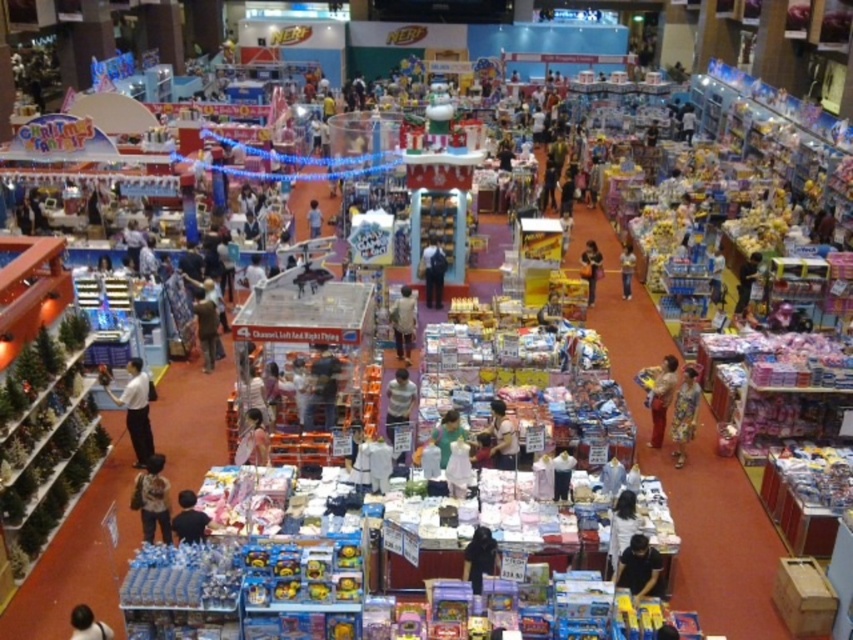
Who is lower down, white matte shirt at lower left or matte black bag at center?

white matte shirt at lower left is lower down.

Does white matte shirt at lower left have a lesser height compared to matte black bag at center?

Incorrect, white matte shirt at lower left's height does not fall short of matte black bag at center's.

Is point (154, 449) closer to viewer compared to point (584, 275)?

Yes, it is in front of point (584, 275).

Where is `white matte shirt at lower left`? This screenshot has width=853, height=640. white matte shirt at lower left is located at coordinates click(136, 410).

Measure the distance from matte yellow shirt at center to light brown fabric shirt at center.

matte yellow shirt at center and light brown fabric shirt at center are 10.25 feet apart from each other.

Who is taller, matte yellow shirt at center or light brown fabric shirt at center?

Standing taller between the two is matte yellow shirt at center.

Is point (657, 401) farther from camera compared to point (503, 417)?

Yes, point (657, 401) is behind point (503, 417).

The height and width of the screenshot is (640, 853). Identify the location of matte yellow shirt at center. (x=660, y=396).

What do you see at coordinates (639, 568) in the screenshot? Image resolution: width=853 pixels, height=640 pixels. I see `black matte shirt at lower center` at bounding box center [639, 568].

Is black matte shirt at lower center in front of green fabric dress at center?

Yes, it is.

Does point (619, 566) lie behind point (445, 445)?

No.

This screenshot has height=640, width=853. I want to click on black matte shirt at lower center, so [x=639, y=568].